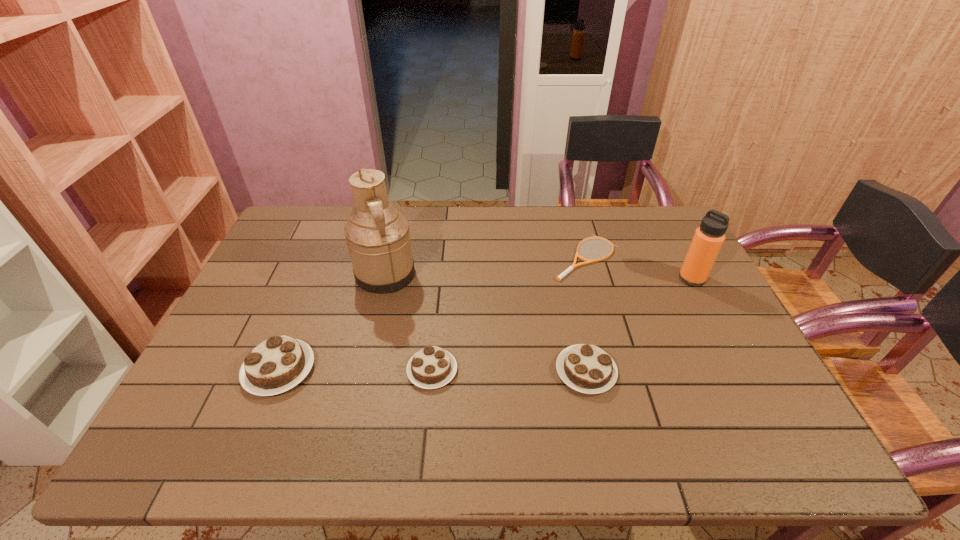
Given the evenly spaced chocolate cakes in the image, where should an extra chocolate cake be added on the right to preserve the spacing? Please point to a vacant space. Please provide its 2D coordinates. Your answer should be formatted as a tuple, i.e. [(x, y)], where the tuple contains the x and y coordinates of a point satisfying the conditions above.

[(740, 372)]